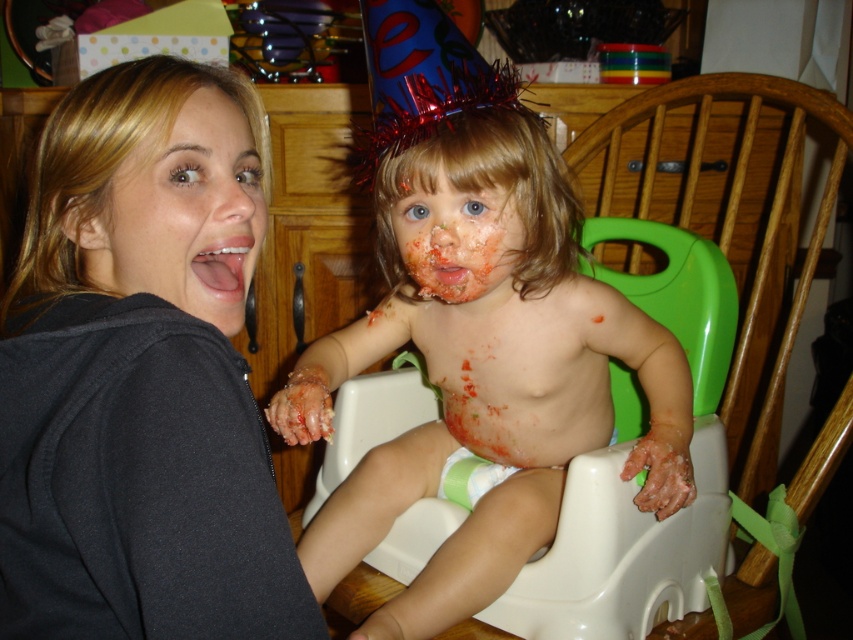
Question: Among these objects, which one is nearest to the camera?

Choices:
 (A) matte plastic baby at center
 (B) matte orange face at center
 (C) matte black hoodie at upper left
 (D) smooth skin face at left

Answer: (C)

Question: Which of these objects is positioned farthest from the matte orange face at center?

Choices:
 (A) matte black hoodie at upper left
 (B) matte plastic baby at center
 (C) smooth skin face at left

Answer: (A)

Question: Does matte black hoodie at upper left have a larger size compared to matte orange face at center?

Choices:
 (A) no
 (B) yes

Answer: (B)

Question: Does matte plastic baby at center appear on the left side of smooth skin face at left?

Choices:
 (A) yes
 (B) no

Answer: (B)

Question: Is matte black hoodie at upper left in front of matte plastic baby at center?

Choices:
 (A) yes
 (B) no

Answer: (A)

Question: Which point is farther to the camera?

Choices:
 (A) matte black hoodie at upper left
 (B) smooth skin face at left
 (C) matte orange face at center
 (D) matte plastic baby at center

Answer: (C)